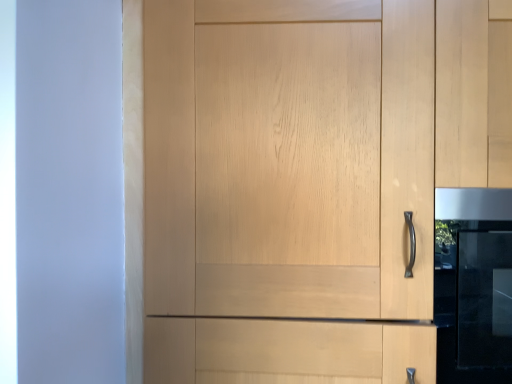
Question: From a real-world perspective, relative to satin black oven at right, is light wood cupboard at center vertically above or below?

Choices:
 (A) below
 (B) above

Answer: (B)

Question: From the image's perspective, is light wood cupboard at center above or below satin black oven at right?

Choices:
 (A) below
 (B) above

Answer: (B)

Question: In the image, is light wood cupboard at center positioned in front of or behind satin black oven at right?

Choices:
 (A) behind
 (B) front

Answer: (B)

Question: Considering the positions of satin black oven at right and light wood cupboard at center in the image, is satin black oven at right bigger or smaller than light wood cupboard at center?

Choices:
 (A) small
 (B) big

Answer: (A)

Question: Is satin black oven at right taller or shorter than light wood cupboard at center?

Choices:
 (A) short
 (B) tall

Answer: (A)

Question: Considering the relative positions of satin black oven at right and light wood cupboard at center in the image provided, is satin black oven at right to the left or to the right of light wood cupboard at center?

Choices:
 (A) right
 (B) left

Answer: (A)

Question: Is satin black oven at right situated inside light wood cupboard at center or outside?

Choices:
 (A) outside
 (B) inside

Answer: (B)